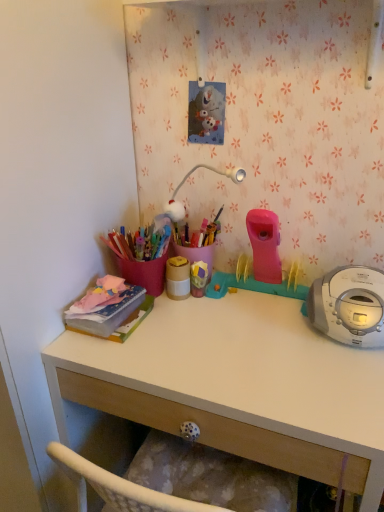
You are a GUI agent. You are given a task and a screenshot of the screen. Output one action in this format:
    pyautogui.click(x=<x>, y=<y>)
    Task: Click on the free space in front of matte gold container at center, which is the 1th office supplies from right to left
    
    Given the screenshot: What is the action you would take?
    pyautogui.click(x=184, y=333)